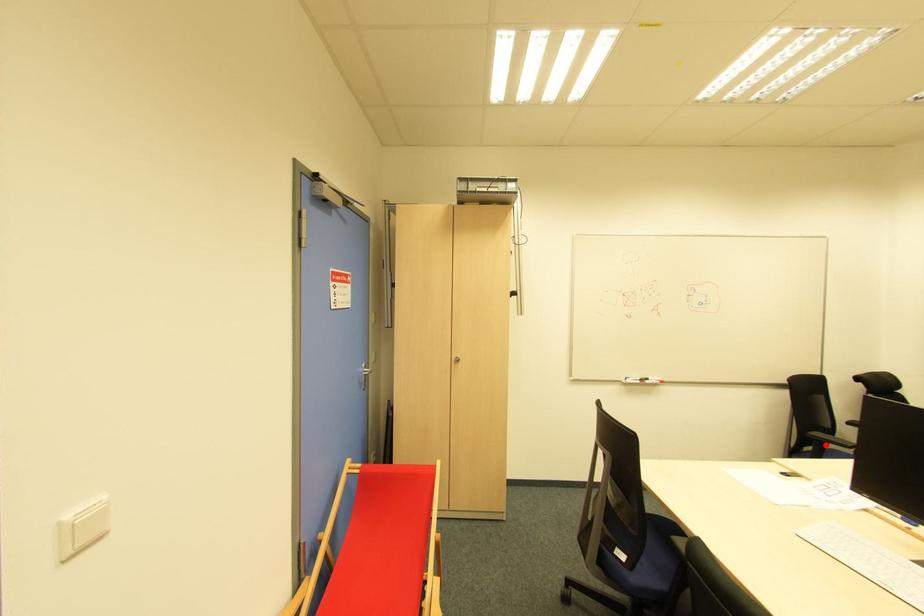
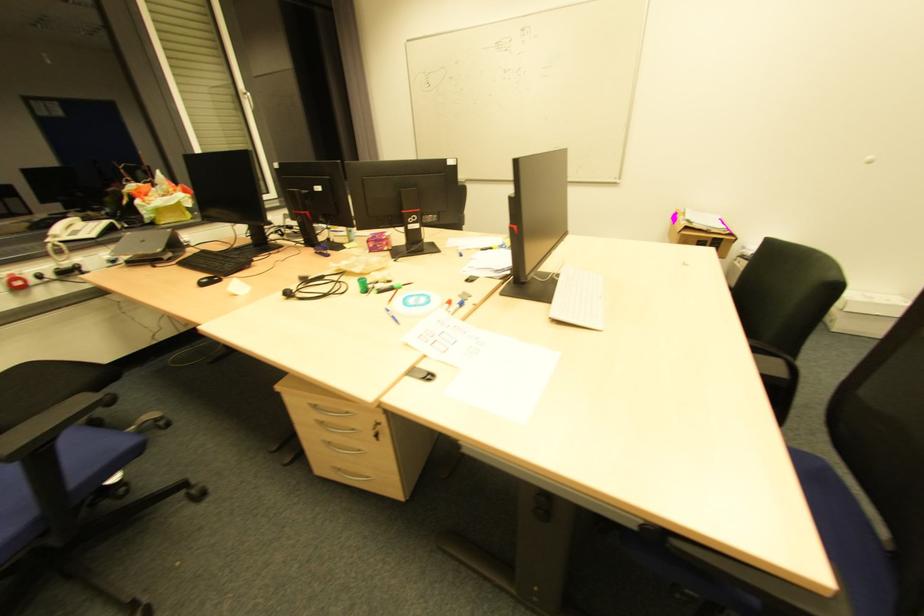
Question: I am providing you with two images of the same scene from different viewpoints. A red point is shown in image1. For the corresponding object point in image2, is it positioned nearer or farther from the camera?

Choices:
 (A) Nearer
 (B) Farther

Answer: (A)